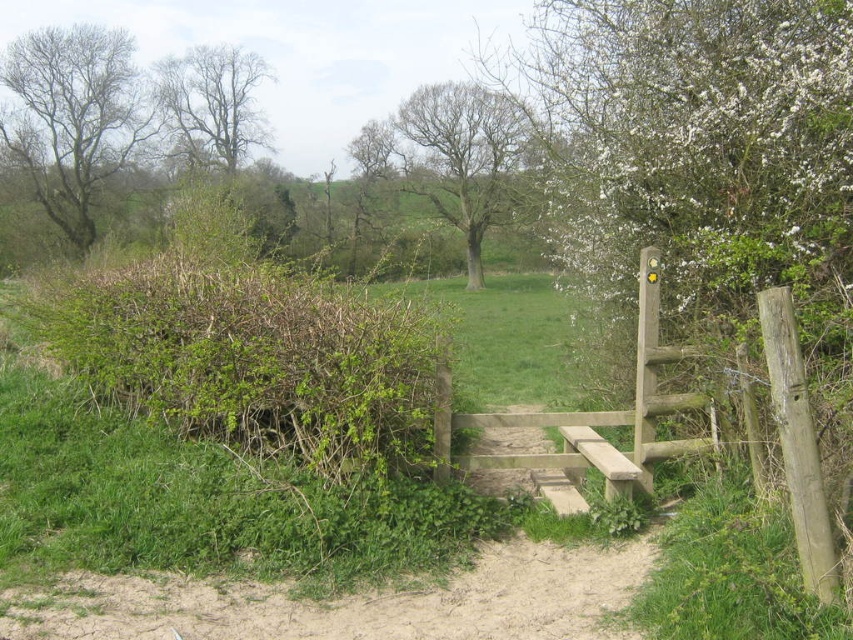
Question: Which of the following is the farthest from the observer?

Choices:
 (A) (183, 115)
 (B) (482, 96)

Answer: (A)

Question: Can you confirm if bare brown tree at center is wider than bare branches tree at upper left?

Choices:
 (A) yes
 (B) no

Answer: (A)

Question: Considering the real-world distances, which object is closest to the bare brown tree at center?

Choices:
 (A) bare branches at left
 (B) bare branches tree at upper left
 (C) green leafy hedge at left

Answer: (B)

Question: Does green leafy hedge at left lie behind bare branches tree at upper left?

Choices:
 (A) no
 (B) yes

Answer: (A)

Question: Does green leafy hedge at left appear on the right side of bare branches at left?

Choices:
 (A) no
 (B) yes

Answer: (B)

Question: Among these objects, which one is farthest from the camera?

Choices:
 (A) green leafy hedge at left
 (B) bare branches tree at upper left

Answer: (B)